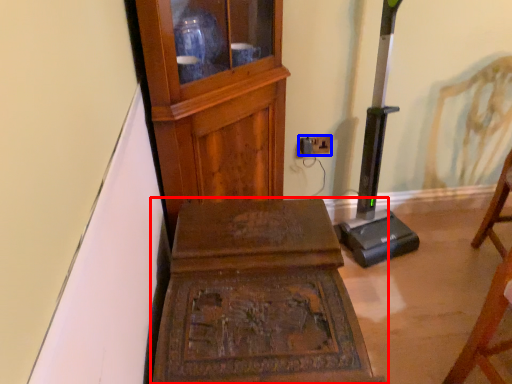
Question: Which of the following is the farthest to the observer, furniture (highlighted by a red box) or electric outlet (highlighted by a blue box)?

Choices:
 (A) furniture
 (B) electric outlet

Answer: (B)